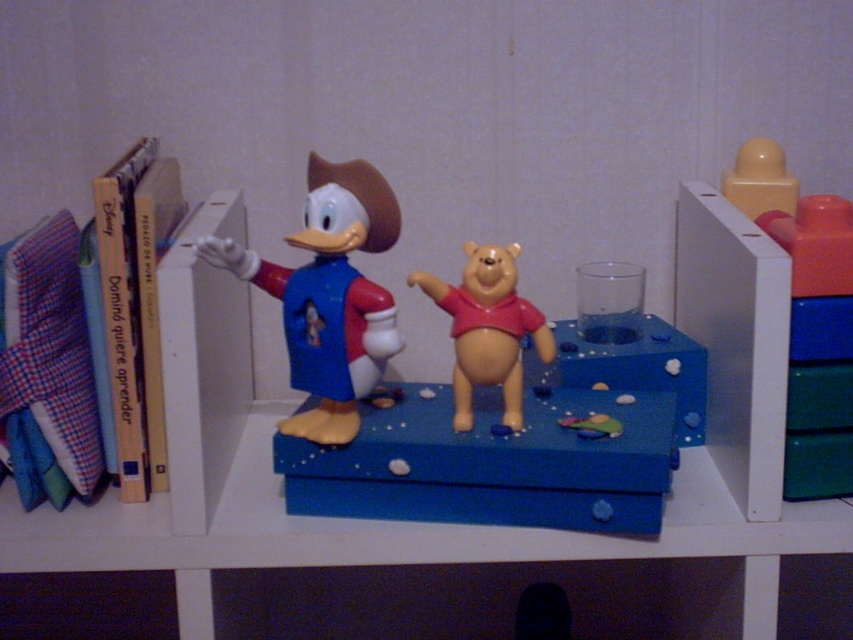
Is matte plastic duck at center wider than rubberized plastic block at right?

Yes.

Between matte plastic duck at center and rubberized plastic block at right, which one has more height?

Standing taller between the two is matte plastic duck at center.

Is point (363, 381) positioned in front of point (786, 465)?

That is True.

Locate an element on the screen. matte plastic duck at center is located at coordinates (329, 294).

Between rubberized plastic block at right and rubber duck at center, which one is positioned higher?

rubberized plastic block at right is higher up.

Is rubberized plastic block at right to the left of rubber duck at center from the viewer's perspective?

Incorrect, rubberized plastic block at right is not on the left side of rubber duck at center.

Is point (790, 236) farther from camera compared to point (614, 432)?

No.

Where is `rubberized plastic block at right`? The width and height of the screenshot is (853, 640). rubberized plastic block at right is located at coordinates click(817, 342).

Who is lower down, smooth yellow bear at center or yellow matte block at upper right?

Positioned lower is smooth yellow bear at center.

Is smooth yellow bear at center to the left of yellow matte block at upper right from the viewer's perspective?

Correct, you'll find smooth yellow bear at center to the left of yellow matte block at upper right.

In order to click on smooth yellow bear at center in this screenshot , I will do `click(486, 328)`.

Image resolution: width=853 pixels, height=640 pixels. What are the coordinates of `smooth yellow bear at center` in the screenshot? It's located at (486, 328).